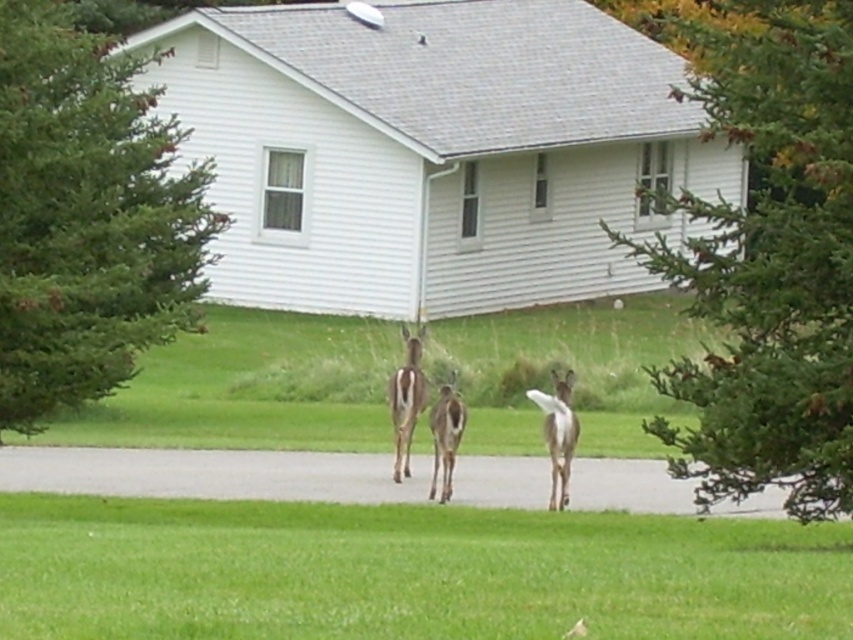
You are standing at the point marked by the coordinates point [408,572] in the image. What do you see directly beneath you?

The point [408,572] indicates green grass at lower center, so you would see green grass directly beneath you.